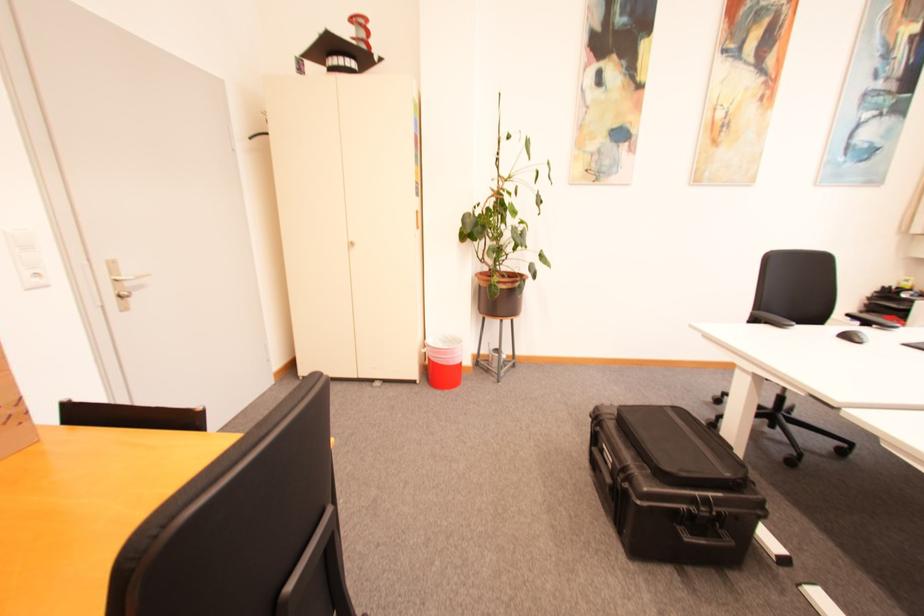
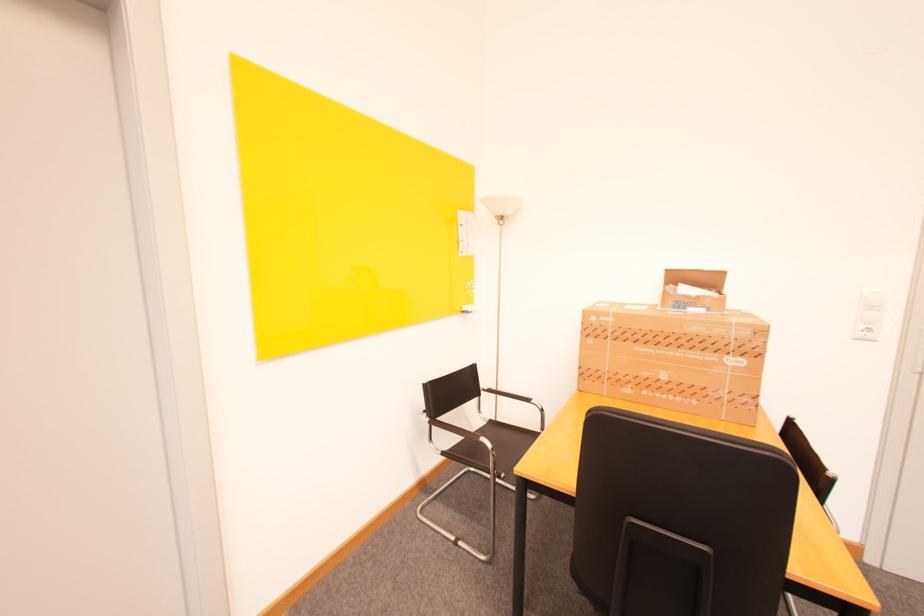
The first image is from the beginning of the video and the second image is from the end. How did the camera likely rotate when shooting the video?

The camera's rotation is toward left-down.